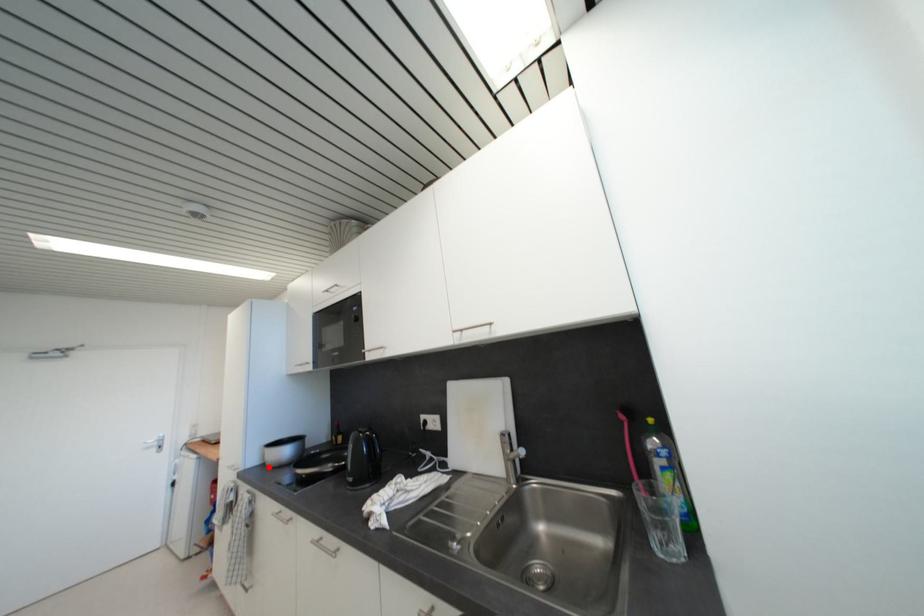
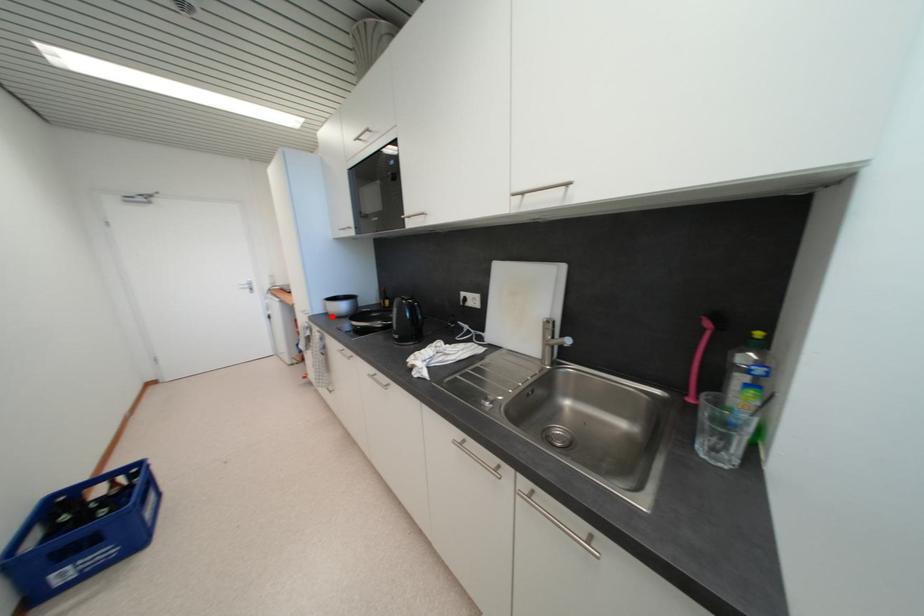
I am providing you with two images of the same scene from different viewpoints. A red point is marked on the first image and another point is marked on the second image. Does the point marked in image1 correspond to the same location as the one in image2?

Yes